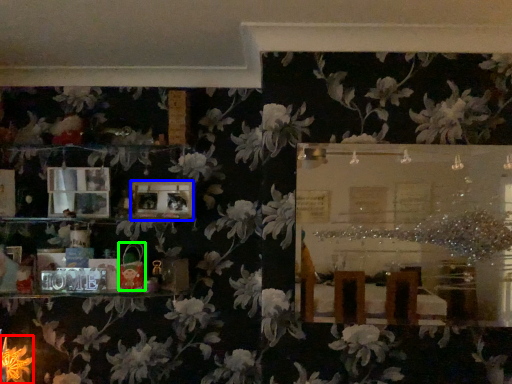
Question: Which object is positioned closest to flower (highlighted by a red box)? Select from picture frame (highlighted by a blue box) and toy (highlighted by a green box).

Choices:
 (A) picture frame
 (B) toy

Answer: (B)